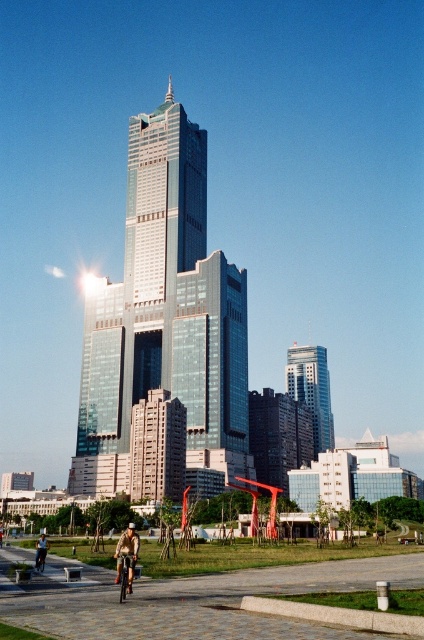
You are standing at the base of the skyscraper and want to reach a point marked at coordinates point (167, 435). If you walk directly towards it, how far will you have to walk?

The distance between you and point (167, 435) is 279.22 feet, so you will have to walk 279.22 feet to reach it.

Based on the photo, you are standing at the base of the shiny glass skyscraper at center. If you walk 50 meters straight towards the camera, will you still be able to see the entire building in your view?

The shiny glass skyscraper at center is 83.74 meters away from the camera. If you walk 50 meters towards the camera, you will be 33.74 meters away from the camera. Since the building is still within your line of sight, you will still be able to see the entire building in your view.

You are a drone operator trying to capture aerial footage of the shiny glass skyscraper at center and the silver metallic skyscraper at center. Which skyscraper will require a wider camera frame to fully capture its structure?

The shiny glass skyscraper at center has a larger size compared to the silver metallic skyscraper at center, so it will require a wider camera frame to fully capture its structure.